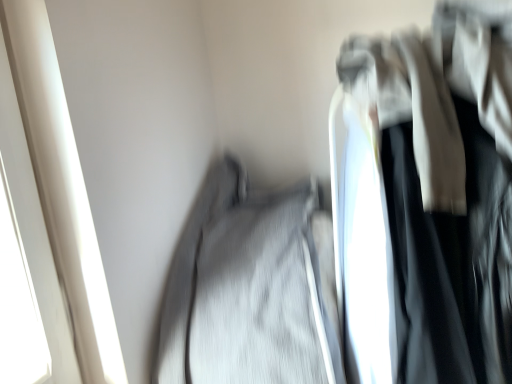
The image size is (512, 384). I want to click on gray cotton sweatshirt at center, so click(x=247, y=290).

Describe the element at coordinates (247, 290) in the screenshot. The height and width of the screenshot is (384, 512). I see `gray cotton sweatshirt at center` at that location.

Where is `gray cotton sweatshirt at center`? gray cotton sweatshirt at center is located at coordinates (247, 290).